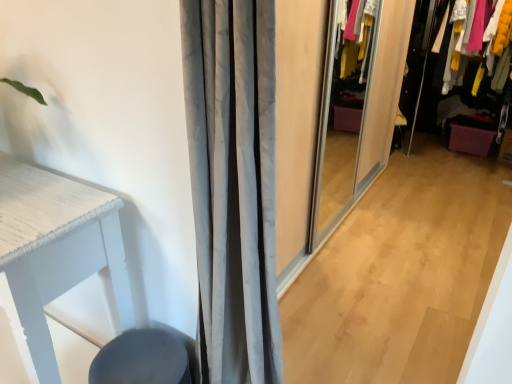
At what (x,y) coordinates should I click in order to perform the action: click on free point below velvet purple drawer at right (from a real-world perspective). Please return your answer as a coordinate pair (x, y). Looking at the image, I should click on (459, 171).